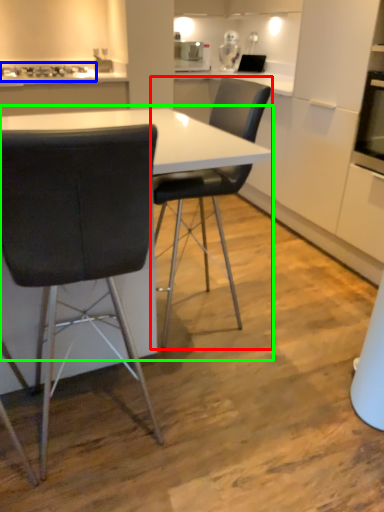
Question: Which object is the farthest from chair (highlighted by a red box)? Choose among these: gas stove (highlighted by a blue box) or table (highlighted by a green box).

Choices:
 (A) gas stove
 (B) table

Answer: (A)